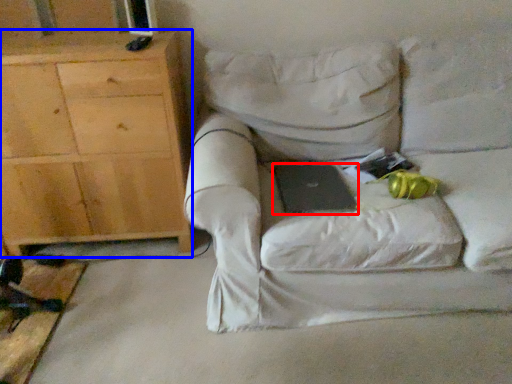
Question: Which object appears closest to the camera in this image, laptop (highlighted by a red box) or cabinetry (highlighted by a blue box)?

Choices:
 (A) laptop
 (B) cabinetry

Answer: (A)